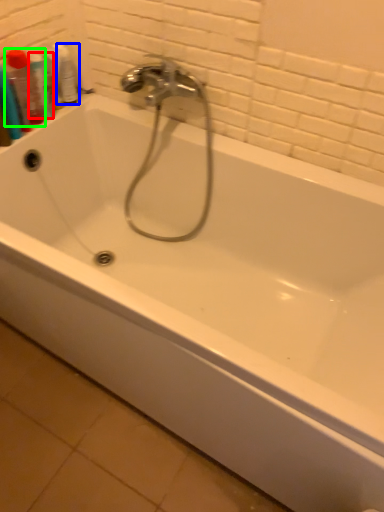
Question: Considering the real-world distances, which object is closest to mouthwash (highlighted by a red box)? mouthwash (highlighted by a blue box) or mouthwash (highlighted by a green box).

Choices:
 (A) mouthwash
 (B) mouthwash

Answer: (B)